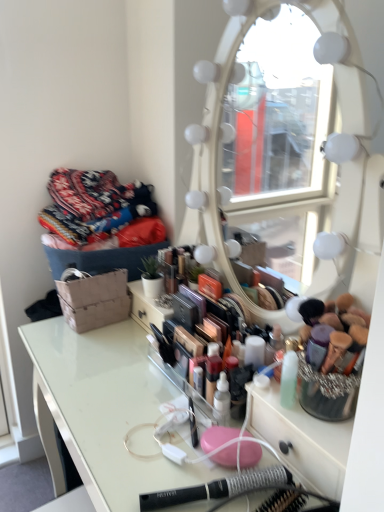
I want to click on free space to the left of black plastic hairbrush at lower center, so click(130, 462).